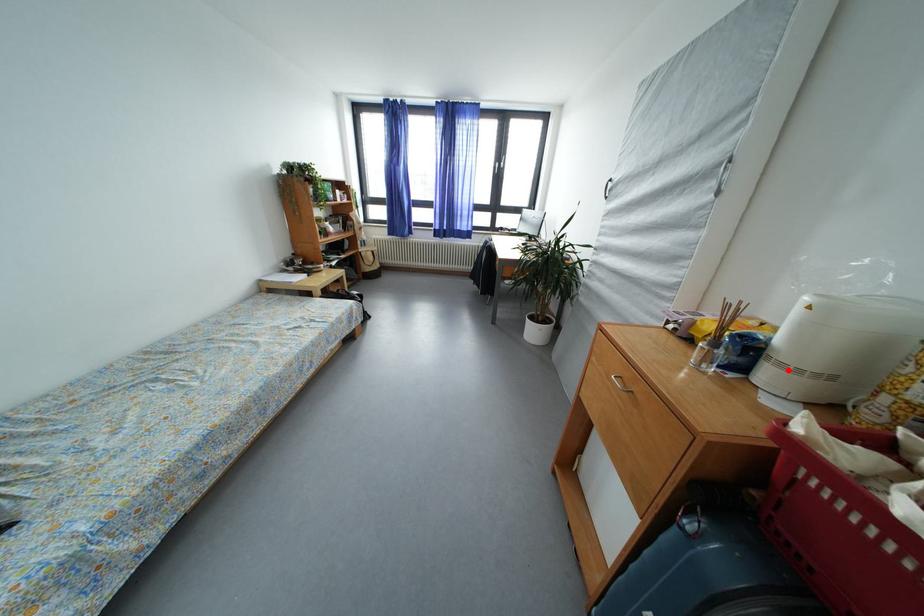
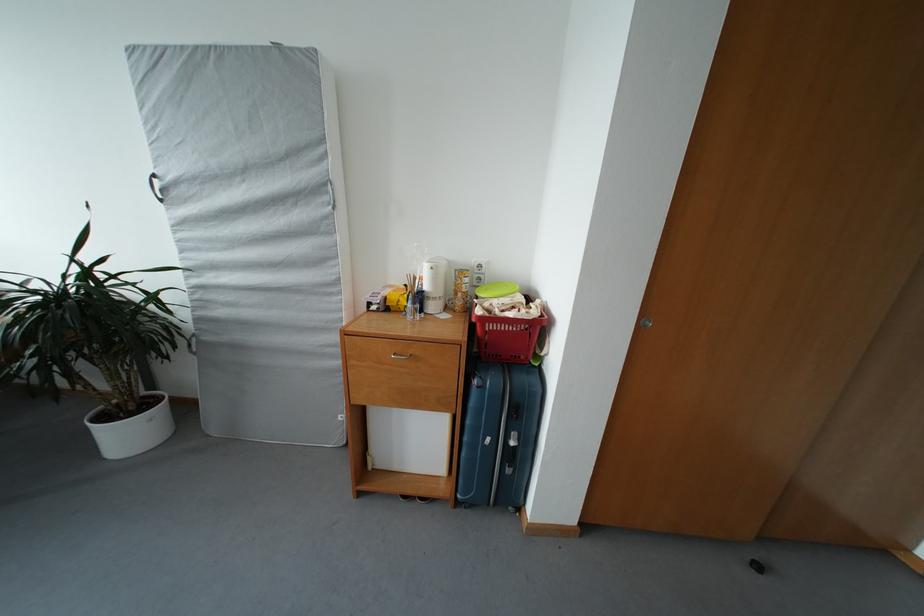
In the second image, find the point that corresponds to the highlighted location in the first image.

(441, 304)